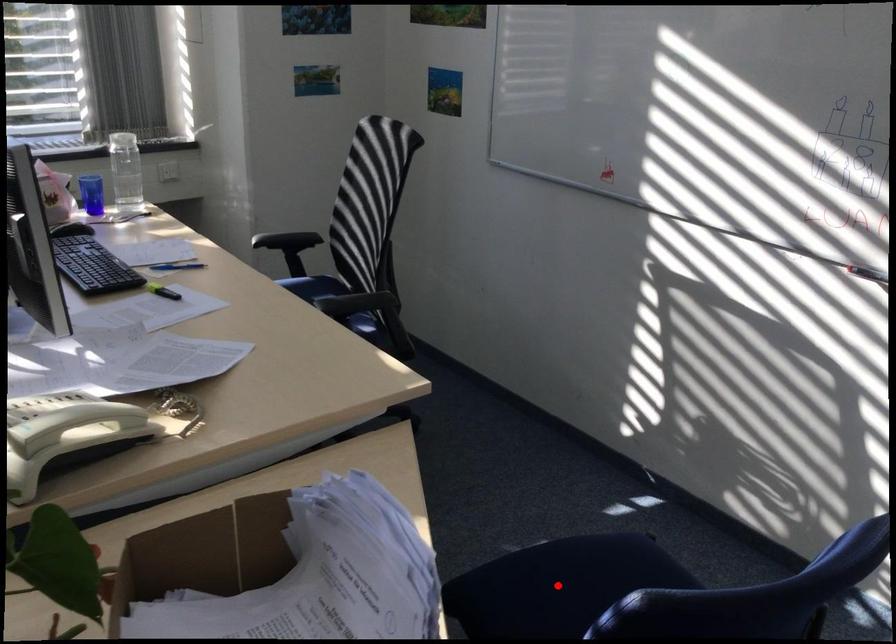
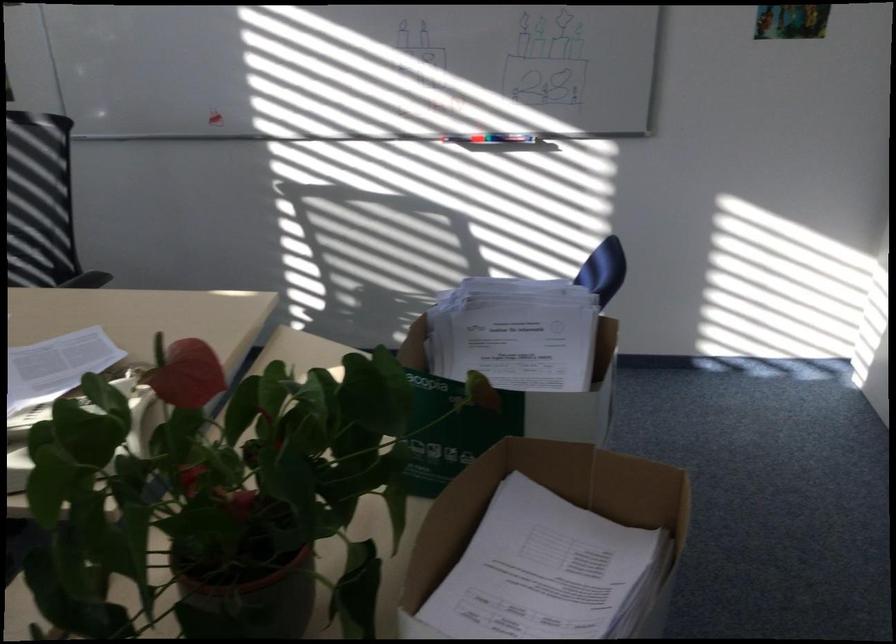
Question: I am providing you with two images of the same scene from different viewpoints. A red point is marked on the first image. At the location where the point appears in image 1, is it still visible in image 2?

Choices:
 (A) Yes
 (B) No

Answer: (B)